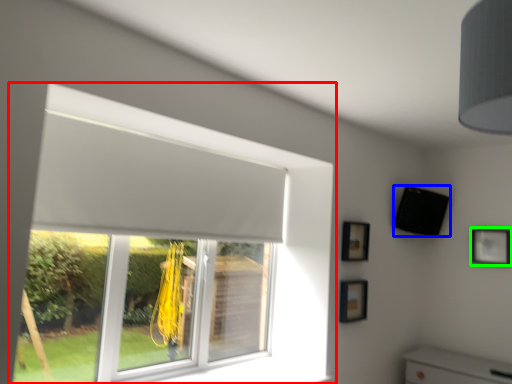
Question: Which object is the closest to the window (highlighted by a red box)? Choose among these: speaker (highlighted by a blue box) or picture frame (highlighted by a green box).

Choices:
 (A) speaker
 (B) picture frame

Answer: (A)